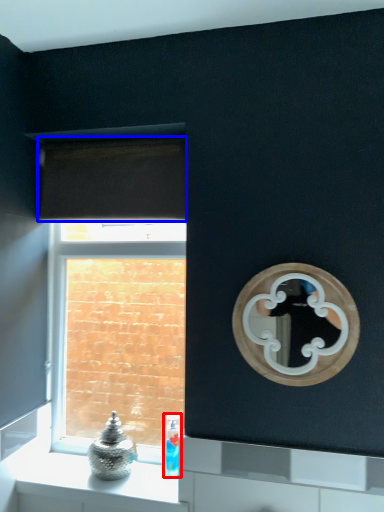
Question: Which point is closer to the camera, toiletry (highlighted by a red box) or curtain (highlighted by a blue box)?

Choices:
 (A) toiletry
 (B) curtain

Answer: (B)